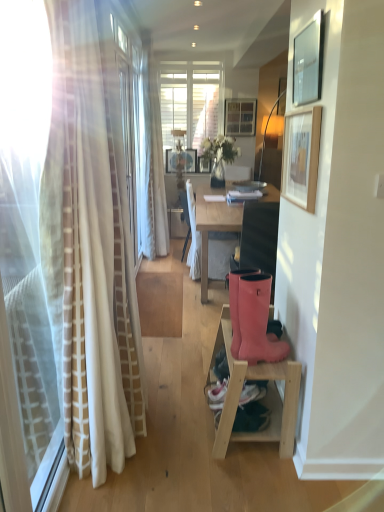
Question: Is pink rubber boots at lower right next to wooden picture frame at upper right, placed as the 2th picture frame when sorted from front to back?

Choices:
 (A) yes
 (B) no

Answer: (B)

Question: Is pink rubber boots at lower right to the right of wooden picture frame at upper right, placed as the 4th picture frame when sorted from top to bottom, from the viewer's perspective?

Choices:
 (A) yes
 (B) no

Answer: (A)

Question: Is pink rubber boots at lower right facing away from wooden picture frame at upper right, placed as the 2th picture frame when sorted from front to back?

Choices:
 (A) no
 (B) yes

Answer: (B)

Question: From the image's perspective, does pink rubber boots at lower right appear higher than wooden picture frame at upper right, marked as the 3th picture frame in a right-to-left arrangement?

Choices:
 (A) yes
 (B) no

Answer: (B)

Question: Is pink rubber boots at lower right closer to the viewer compared to wooden picture frame at upper right, which is the second picture frame in left-to-right order?

Choices:
 (A) yes
 (B) no

Answer: (B)

Question: Is pink rubber boots at lower right at the left side of wooden picture frame at upper right, the first picture frame positioned from the bottom?

Choices:
 (A) yes
 (B) no

Answer: (B)

Question: Is white fabric chair at center positioned with its back to translucent glass vase at center?

Choices:
 (A) no
 (B) yes

Answer: (A)

Question: Would you say white fabric chair at center contains translucent glass vase at center?

Choices:
 (A) no
 (B) yes

Answer: (A)

Question: From the image's perspective, is white fabric chair at center beneath translucent glass vase at center?

Choices:
 (A) no
 (B) yes

Answer: (B)

Question: Can we say white fabric chair at center lies outside translucent glass vase at center?

Choices:
 (A) no
 (B) yes

Answer: (B)

Question: Can you confirm if white fabric chair at center is bigger than translucent glass vase at center?

Choices:
 (A) no
 (B) yes

Answer: (B)

Question: Considering the relative positions of white fabric chair at center and translucent glass vase at center in the image provided, is white fabric chair at center to the left of translucent glass vase at center from the viewer's perspective?

Choices:
 (A) yes
 (B) no

Answer: (A)

Question: Is wooden picture frame at upper center, which is the 3th picture frame from front to back, positioned with its back to matte black picture frame at upper right, which is the second picture frame in right-to-left order?

Choices:
 (A) yes
 (B) no

Answer: (B)